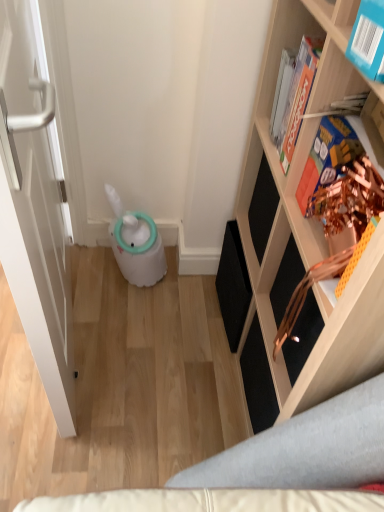
Question: Is blue cardboard book at upper right, which is counted as the first book, starting from the front, thinner than wooden shelf at right?

Choices:
 (A) no
 (B) yes

Answer: (B)

Question: From a real-world perspective, is blue cardboard book at upper right, which is counted as the first book, starting from the front, over wooden shelf at right?

Choices:
 (A) yes
 (B) no

Answer: (A)

Question: Is blue cardboard book at upper right, which is counted as the first book, starting from the front, closer to camera compared to wooden shelf at right?

Choices:
 (A) no
 (B) yes

Answer: (A)

Question: Is blue cardboard book at upper right, acting as the third book starting from the back, looking in the opposite direction of wooden shelf at right?

Choices:
 (A) yes
 (B) no

Answer: (A)

Question: Is wooden shelf at right surrounded by blue cardboard book at upper right, acting as the third book starting from the back?

Choices:
 (A) no
 (B) yes

Answer: (A)

Question: From the image's perspective, does blue cardboard book at upper right, acting as the third book starting from the back, appear higher than wooden shelf at right?

Choices:
 (A) yes
 (B) no

Answer: (A)

Question: Is hardcover book at upper right, which ranks as the third book in front-to-back order, to the right of blue cardboard book at upper right, acting as the third book starting from the back, from the viewer's perspective?

Choices:
 (A) yes
 (B) no

Answer: (B)

Question: Is hardcover book at upper right, the 1th book when ordered from back to front, outside of blue cardboard book at upper right, which is counted as the first book, starting from the front?

Choices:
 (A) no
 (B) yes

Answer: (B)

Question: Does hardcover book at upper right, which ranks as the third book in front-to-back order, lie in front of blue cardboard book at upper right, acting as the third book starting from the back?

Choices:
 (A) no
 (B) yes

Answer: (A)

Question: From the image's perspective, is hardcover book at upper right, which ranks as the third book in front-to-back order, below blue cardboard book at upper right, which is counted as the first book, starting from the front?

Choices:
 (A) no
 (B) yes

Answer: (A)

Question: Are hardcover book at upper right, which ranks as the third book in front-to-back order, and blue cardboard book at upper right, acting as the third book starting from the back, far apart?

Choices:
 (A) no
 (B) yes

Answer: (A)

Question: From a real-world perspective, is hardcover book at upper right, the 1th book when ordered from back to front, positioned under blue cardboard book at upper right, acting as the third book starting from the back, based on gravity?

Choices:
 (A) no
 (B) yes

Answer: (B)

Question: From a real-world perspective, is blue cardboard book at upper right, which is counted as the first book, starting from the front, positioned under hardcover book at upper right, the 1th book when ordered from back to front, based on gravity?

Choices:
 (A) yes
 (B) no

Answer: (B)